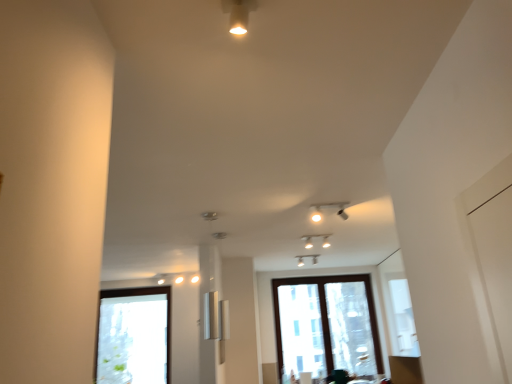
This screenshot has height=384, width=512. Identify the location of clear glass window at lower left, the second window positioned from the right. (133, 336).

What do you see at coordinates (133, 336) in the screenshot? The height and width of the screenshot is (384, 512). I see `clear glass window at lower left, the second window positioned from the right` at bounding box center [133, 336].

Where is `clear glass window at center, positioned as the 1th window in right-to-left order`? clear glass window at center, positioned as the 1th window in right-to-left order is located at coordinates (326, 326).

Describe the element at coordinates (326, 326) in the screenshot. I see `clear glass window at center, positioned as the 1th window in right-to-left order` at that location.

How much space does clear glass window at center, positioned as the 1th window in right-to-left order, occupy horizontally?

4.13 inches.

Find the location of a particular element. clear glass window at lower left, positioned as the 1th window in left-to-right order is located at coordinates (133, 336).

Considering the relative positions of clear glass window at lower left, the second window positioned from the right, and clear glass window at center, positioned as the 1th window in right-to-left order, in the image provided, is clear glass window at lower left, the second window positioned from the right, to the left of clear glass window at center, positioned as the 1th window in right-to-left order, from the viewer's perspective?

Yes.

Does clear glass window at lower left, the second window positioned from the right, lie in front of clear glass window at center, positioned as the 1th window in right-to-left order?

Yes, clear glass window at lower left, the second window positioned from the right, is closer to the camera.

Between point (156, 374) and point (335, 328), which one is positioned behind?

The point (335, 328) is farther from the camera.

From the image's perspective, is clear glass window at lower left, positioned as the 1th window in left-to-right order, below clear glass window at center, positioned as the 1th window in right-to-left order?

Correct, clear glass window at lower left, positioned as the 1th window in left-to-right order, appears lower than clear glass window at center, positioned as the 1th window in right-to-left order, in the image.

From a real-world perspective, is clear glass window at lower left, positioned as the 1th window in left-to-right order, physically located above or below clear glass window at center, which is the 2th window in left-to-right order?

clear glass window at lower left, positioned as the 1th window in left-to-right order, is situated higher than clear glass window at center, which is the 2th window in left-to-right order, in the real world.

Considering the relative sizes of clear glass window at lower left, the second window positioned from the right, and clear glass window at center, which is the 2th window in left-to-right order, in the image provided, is clear glass window at lower left, the second window positioned from the right, thinner than clear glass window at center, which is the 2th window in left-to-right order,?

Incorrect, the width of clear glass window at lower left, the second window positioned from the right, is not less than that of clear glass window at center, which is the 2th window in left-to-right order.

Which of these two, clear glass window at lower left, the second window positioned from the right, or clear glass window at center, positioned as the 1th window in right-to-left order, stands shorter?

clear glass window at lower left, the second window positioned from the right, is shorter.

Based on their sizes in the image, would you say clear glass window at lower left, the second window positioned from the right, is bigger or smaller than clear glass window at center, positioned as the 1th window in right-to-left order?

In the image, clear glass window at lower left, the second window positioned from the right, appears to be larger than clear glass window at center, positioned as the 1th window in right-to-left order.

Is clear glass window at lower left, positioned as the 1th window in left-to-right order, inside or outside of clear glass window at center, positioned as the 1th window in right-to-left order?

clear glass window at lower left, positioned as the 1th window in left-to-right order, exists outside the volume of clear glass window at center, positioned as the 1th window in right-to-left order.

From the picture: Is clear glass window at lower left, the second window positioned from the right, far away from clear glass window at center, positioned as the 1th window in right-to-left order?

That's right, there is a large distance between clear glass window at lower left, the second window positioned from the right, and clear glass window at center, positioned as the 1th window in right-to-left order.

Does clear glass window at lower left, the second window positioned from the right, turn towards clear glass window at center, which is the 2th window in left-to-right order?

No, clear glass window at lower left, the second window positioned from the right, is not aimed at clear glass window at center, which is the 2th window in left-to-right order.

How different are the orientations of clear glass window at lower left, the second window positioned from the right, and clear glass window at center, which is the 2th window in left-to-right order, in degrees?

1.07 degrees.

Where is `window on the right of clear glass window at lower left, positioned as the 1th window in left-to-right order`? This screenshot has height=384, width=512. window on the right of clear glass window at lower left, positioned as the 1th window in left-to-right order is located at coordinates (326, 326).

Considering the positions of objects clear glass window at center, which is the 2th window in left-to-right order, and clear glass window at lower left, positioned as the 1th window in left-to-right order, in the image provided, who is more to the right, clear glass window at center, which is the 2th window in left-to-right order, or clear glass window at lower left, positioned as the 1th window in left-to-right order,?

From the viewer's perspective, clear glass window at center, which is the 2th window in left-to-right order, appears more on the right side.

Is clear glass window at center, positioned as the 1th window in right-to-left order, positioned behind clear glass window at lower left, the second window positioned from the right?

Yes, clear glass window at center, positioned as the 1th window in right-to-left order, is further from the viewer.

Which point is more distant from viewer, (332,328) or (100,295)?

The point (332,328) is farther from the camera.

From the image's perspective, which is below, clear glass window at center, positioned as the 1th window in right-to-left order, or clear glass window at lower left, positioned as the 1th window in left-to-right order?

clear glass window at lower left, positioned as the 1th window in left-to-right order.

Consider the image. From a real-world perspective, is clear glass window at center, which is the 2th window in left-to-right order, under clear glass window at lower left, the second window positioned from the right?

Yes, from a real-world perspective, clear glass window at center, which is the 2th window in left-to-right order, is under clear glass window at lower left, the second window positioned from the right.

Looking at their sizes, would you say clear glass window at center, positioned as the 1th window in right-to-left order, is wider or thinner than clear glass window at lower left, positioned as the 1th window in left-to-right order?

Considering their sizes, clear glass window at center, positioned as the 1th window in right-to-left order, looks slimmer than clear glass window at lower left, positioned as the 1th window in left-to-right order.

In terms of height, does clear glass window at center, which is the 2th window in left-to-right order, look taller or shorter compared to clear glass window at lower left, the second window positioned from the right?

Clearly, clear glass window at center, which is the 2th window in left-to-right order, is taller compared to clear glass window at lower left, the second window positioned from the right.

Considering the relative sizes of clear glass window at center, which is the 2th window in left-to-right order, and clear glass window at lower left, the second window positioned from the right, in the image provided, is clear glass window at center, which is the 2th window in left-to-right order, smaller than clear glass window at lower left, the second window positioned from the right,?

Yes.

Is clear glass window at lower left, the second window positioned from the right, completely or partially inside clear glass window at center, positioned as the 1th window in right-to-left order?

No, clear glass window at lower left, the second window positioned from the right, is not inside clear glass window at center, positioned as the 1th window in right-to-left order.

Would you say clear glass window at center, which is the 2th window in left-to-right order, is a long distance from clear glass window at lower left, positioned as the 1th window in left-to-right order?

clear glass window at center, which is the 2th window in left-to-right order, is far away from clear glass window at lower left, positioned as the 1th window in left-to-right order.

Is clear glass window at lower left, positioned as the 1th window in left-to-right order, at the back of clear glass window at center, positioned as the 1th window in right-to-left order?

No.

How different are the orientations of clear glass window at center, which is the 2th window in left-to-right order, and clear glass window at lower left, positioned as the 1th window in left-to-right order, in degrees?

The angular difference between clear glass window at center, which is the 2th window in left-to-right order, and clear glass window at lower left, positioned as the 1th window in left-to-right order, is 1.07 degrees.

Measure the distance from clear glass window at center, positioned as the 1th window in right-to-left order, to clear glass window at lower left, positioned as the 1th window in left-to-right order.

2.22 meters.

Locate an element on the screen. This screenshot has width=512, height=384. window behind the clear glass window at lower left, positioned as the 1th window in left-to-right order is located at coordinates (326, 326).

Where is `window located underneath the clear glass window at lower left, positioned as the 1th window in left-to-right order (from a real-world perspective)`? window located underneath the clear glass window at lower left, positioned as the 1th window in left-to-right order (from a real-world perspective) is located at coordinates (326, 326).

This screenshot has width=512, height=384. In order to click on window on the right of the clear glass window at lower left, the second window positioned from the right in this screenshot , I will do `click(326, 326)`.